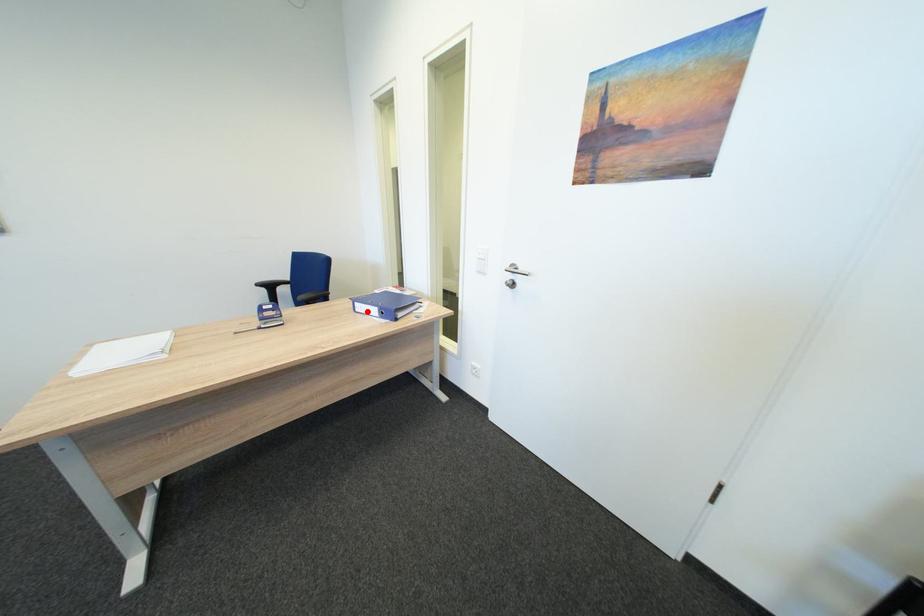
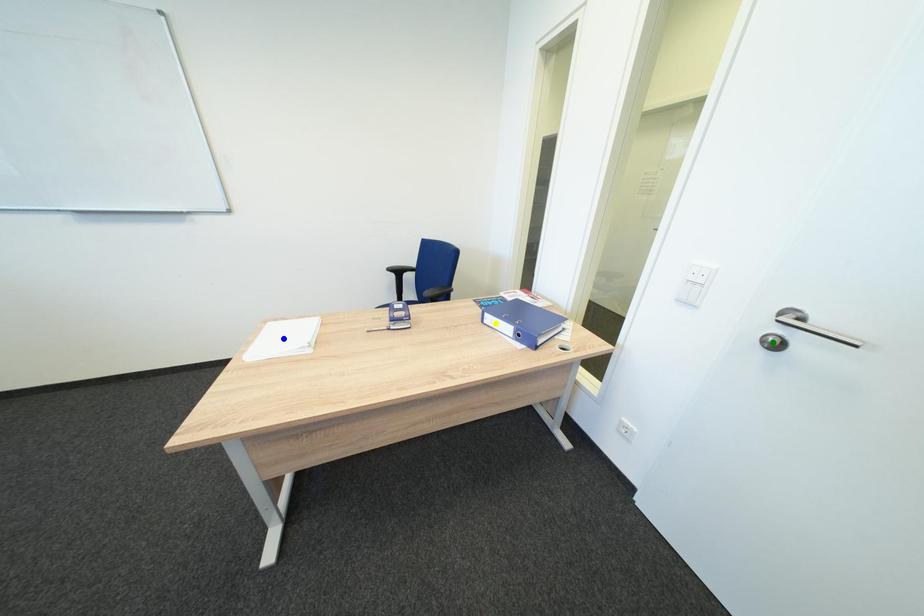
Question: I am providing you with two images of the same scene from different viewpoints. A red point is marked on the first image. You are given multiple points on the second image. In image 2, which mark is for the same physical point as the one in image 1?

Choices:
 (A) blue point
 (B) yellow point
 (C) green point

Answer: (B)